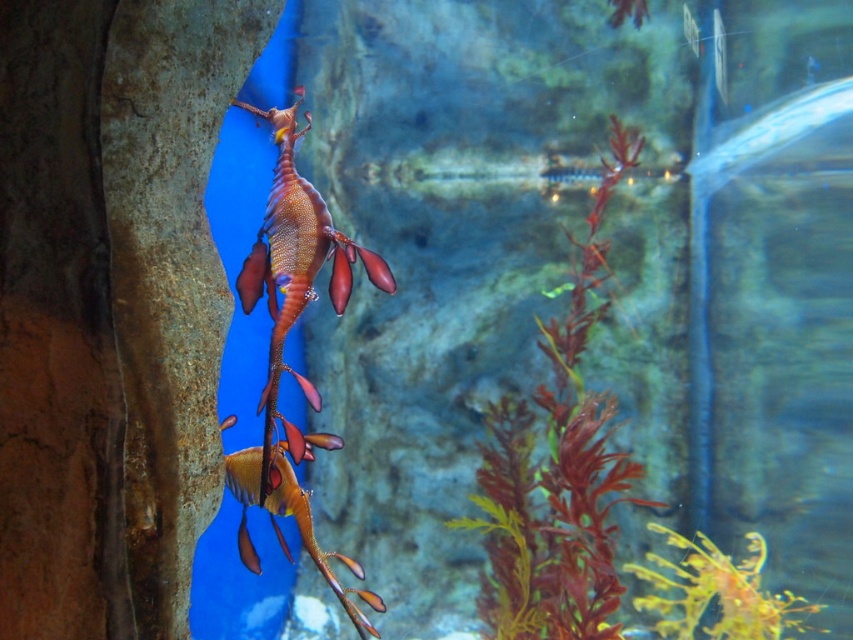
Question: Is translucent glass water at center bigger than reddish-brown leafy plant at center-right?

Choices:
 (A) no
 (B) yes

Answer: (B)

Question: Where is translucent glass water at center located in relation to reddish-brown leafy plant at center-right in the image?

Choices:
 (A) below
 (B) above

Answer: (B)

Question: Among these objects, which one is farthest from the camera?

Choices:
 (A) reddish-brown leafy plant at center-right
 (B) translucent glass water at center

Answer: (B)

Question: Among these points, which one is nearest to the camera?

Choices:
 (A) [x=601, y=582]
 (B) [x=422, y=440]

Answer: (A)

Question: Does translucent glass water at center appear on the right side of reddish-brown leafy plant at center-right?

Choices:
 (A) yes
 (B) no

Answer: (B)